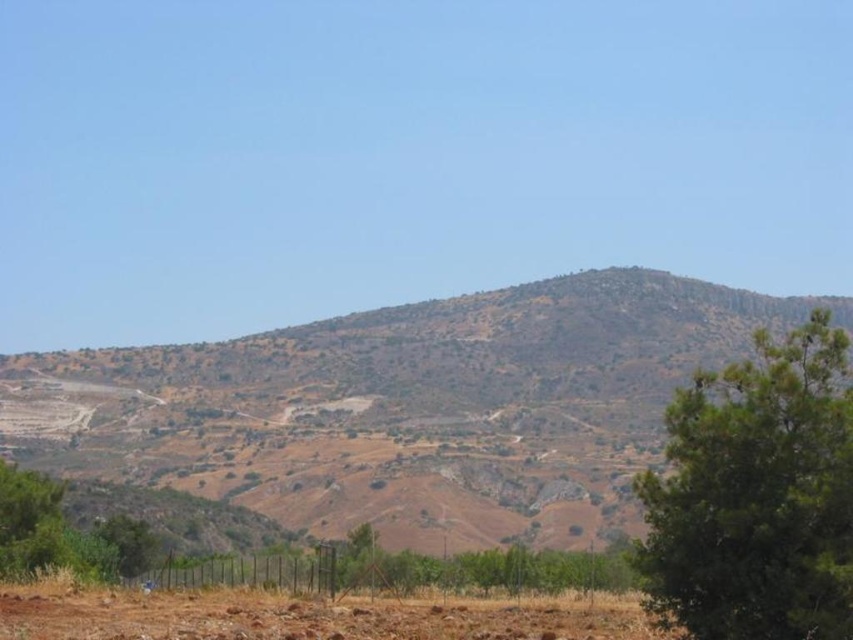
You are standing in the fenced area and want to take a photo of the landscape. There are two points marked in the image, point 1 at coordinates point (387, 435) and point 2 at coordinates point (225, 620). Which point should you stand closer to in order to have the fenced area appear larger in your photo?

To make the fenced area appear larger in your photo, you should stand closer to point (225, 620) because it is closer to the camera, and objects closer to the camera appear larger in the photo.

You are standing at the center of the image and want to locate the green textured tree at right. Based on the coordinates provided, in which direction should you look to find it?

The green textured tree at right is located at coordinates point (756,496), which corresponds to the right side of the image. Therefore, you should look to your right to find it.

You are a hiker planning to take a photo of the green textured tree at right from the foreground. Can you see the entire tree without the brown rocky mountain at center blocking your view?

The green textured tree at right is behind the brown rocky mountain at center, so the mountain will block part of the tree, making it impossible to see the entire tree without obstruction.